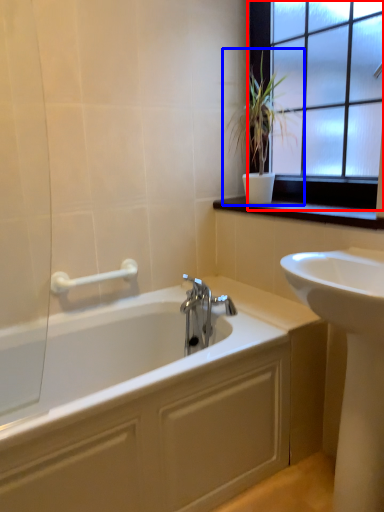
Question: Among these objects, which one is farthest to the camera, window (highlighted by a red box) or houseplant (highlighted by a blue box)?

Choices:
 (A) window
 (B) houseplant

Answer: (B)